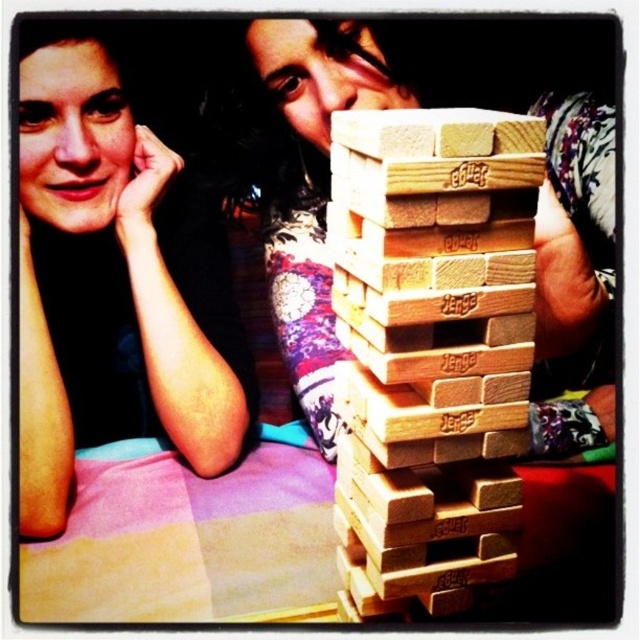
Is natural wood jenga blocks at center bigger than wooden block at center?

Incorrect, natural wood jenga blocks at center is not larger than wooden block at center.

Does point (362, 595) come behind point (349, 109)?

That is False.

Between point (460, 289) and point (348, 116), which one is positioned in front?

Point (460, 289)

Where is `natural wood jenga blocks at center`? natural wood jenga blocks at center is located at coordinates (432, 344).

Between natural wood jenga blocks at center and matte black hair at upper left, which one appears on the right side from the viewer's perspective?

natural wood jenga blocks at center is more to the right.

Does point (397, 460) come in front of point (170, 152)?

Yes, point (397, 460) is in front of point (170, 152).

Does point (371, 150) come farther from viewer compared to point (93, 442)?

No.

Image resolution: width=640 pixels, height=640 pixels. Find the location of `natural wood jenga blocks at center`. natural wood jenga blocks at center is located at coordinates (432, 344).

Which is more to the left, wooden blocks at center or wooden block at center?

wooden block at center is more to the left.

Between wooden blocks at center and wooden block at center, which one has more height?

With more height is wooden blocks at center.

Is point (305, 20) positioned before point (518, 129)?

No.

Where is `wooden blocks at center`? Image resolution: width=640 pixels, height=640 pixels. wooden blocks at center is located at coordinates (305, 173).